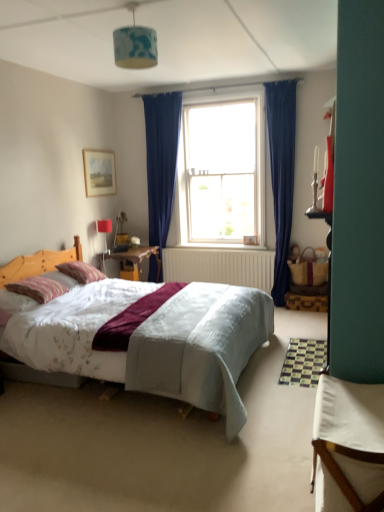
Measure the distance between white glass window at center and camera.

white glass window at center and camera are 5.07 meters apart from each other.

The image size is (384, 512). What do you see at coordinates (221, 170) in the screenshot? I see `white glass window at center` at bounding box center [221, 170].

Find the location of a particular element. The height and width of the screenshot is (512, 384). striped fabric pillow at left, which ranks as the 2th pillow in front-to-back order is located at coordinates (81, 272).

Where is `white fabric table at lower right`? This screenshot has width=384, height=512. white fabric table at lower right is located at coordinates (348, 446).

Does white glass window at center have a larger size compared to striped fabric pillow at left, which ranks as the 2th pillow in front-to-back order?

Indeed, white glass window at center has a larger size compared to striped fabric pillow at left, which ranks as the 2th pillow in front-to-back order.

Considering the relative sizes of white glass window at center and striped fabric pillow at left, which is the first pillow in back-to-front order, in the image provided, is white glass window at center taller than striped fabric pillow at left, which is the first pillow in back-to-front order,?

Yes.

From the image's perspective, which pillow is the 1st one below the white glass window at center? Please provide its 2D coordinates.

[(81, 272)]

Is white glass window at center not near striped fabric pillow at left, which is the first pillow in back-to-front order?

white glass window at center is positioned a significant distance from striped fabric pillow at left, which is the first pillow in back-to-front order.

Is blue fabric lampshade at upper center aimed at striped cotton pillow at left, the first pillow when ordered from front to back?

No, blue fabric lampshade at upper center is not turned towards striped cotton pillow at left, the first pillow when ordered from front to back.

Which is behind, point (122, 30) or point (22, 292)?

The point (22, 292) is farther.

Who is shorter, blue fabric lampshade at upper center or striped cotton pillow at left, marked as the second pillow in a back-to-front arrangement?

striped cotton pillow at left, marked as the second pillow in a back-to-front arrangement.

From the image's perspective, is white fabric table at lower right positioned above or below blue fabric lampshade at upper center?

Clearly, from the image's perspective, white fabric table at lower right is below blue fabric lampshade at upper center.

From the picture: Can you confirm if white fabric table at lower right is shorter than blue fabric lampshade at upper center?

No.

Consider the image. Is white fabric table at lower right positioned before blue fabric lampshade at upper center?

Yes, white fabric table at lower right is closer to the camera.

Is white fabric table at lower right not close to blue fabric lampshade at upper center?

Yes, white fabric table at lower right and blue fabric lampshade at upper center are located far from each other.

Which is farther from the camera, (71, 268) or (152, 42)?

The point (71, 268) is farther.

From a real-world perspective, is striped fabric pillow at left, which is the first pillow in back-to-front order, under blue fabric lampshade at upper center?

Indeed, from a real-world perspective, striped fabric pillow at left, which is the first pillow in back-to-front order, is positioned beneath blue fabric lampshade at upper center.

Which is more to the left, striped fabric pillow at left, which is the first pillow in back-to-front order, or blue fabric lampshade at upper center?

From the viewer's perspective, striped fabric pillow at left, which is the first pillow in back-to-front order, appears more on the left side.

Is striped fabric pillow at left, which is the first pillow in back-to-front order, facing away from blue fabric lampshade at upper center?

No, striped fabric pillow at left, which is the first pillow in back-to-front order, is not facing away from blue fabric lampshade at upper center.

Between white glass window at center and blue fabric lampshade at upper center, which one appears on the left side from the viewer's perspective?

From the viewer's perspective, blue fabric lampshade at upper center appears more on the left side.

Are white glass window at center and blue fabric lampshade at upper center located far from each other?

Yes.

From the picture: Which object is thinner, white glass window at center or blue fabric lampshade at upper center?

With smaller width is blue fabric lampshade at upper center.

Are white glass window at center and white fabric table at lower right making contact?

white glass window at center is not next to white fabric table at lower right, and they're not touching.

From a real-world perspective, between white glass window at center and white fabric table at lower right, who is vertically lower?

From a 3D spatial view, white fabric table at lower right is below.

Does white glass window at center have a larger size compared to white fabric table at lower right?

Indeed, white glass window at center has a larger size compared to white fabric table at lower right.

Looking at their sizes, would you say white glass window at center is wider or thinner than white fabric table at lower right?

white glass window at center is thinner than white fabric table at lower right.

Which point is more forward, (124, 48) or (319, 436)?

The point (319, 436) is more forward.

From the picture: Is blue fabric lampshade at upper center surrounding white fabric table at lower right?

Definitely not — white fabric table at lower right is not inside blue fabric lampshade at upper center.

Is blue fabric lampshade at upper center not near white fabric table at lower right?

Yes.

Starting from the white glass window at center, which pillow is the 1st one in front? Please provide its 2D coordinates.

[(81, 272)]

Which pillow is the 2nd one when counting from the left side of the blue fabric lampshade at upper center? Please provide its 2D coordinates.

[(38, 288)]

Based on their spatial positions, is white glass window at center or blue fabric lampshade at upper center closer to striped fabric pillow at left, which is the first pillow in back-to-front order?

Based on the image, blue fabric lampshade at upper center appears to be nearer to striped fabric pillow at left, which is the first pillow in back-to-front order.

From the image, which object appears to be farther from white fabric table at lower right, striped cotton pillow at left, marked as the second pillow in a back-to-front arrangement, or blue fabric lampshade at upper center?

striped cotton pillow at left, marked as the second pillow in a back-to-front arrangement.

Considering their positions, is wooden picture frame at upper left positioned further to white glass window at center than blue fabric lampshade at upper center?

Based on the image, blue fabric lampshade at upper center appears to be further to white glass window at center.

Estimate the real-world distances between objects in this image. Which object is further from white glass window at center, wooden picture frame at upper left or striped cotton pillow at left, the first pillow when ordered from front to back?

The object further to white glass window at center is striped cotton pillow at left, the first pillow when ordered from front to back.

Looking at the image, which one is located closer to white glass window at center, striped cotton pillow at left, the first pillow when ordered from front to back, or striped fabric pillow at left, which ranks as the 2th pillow in front-to-back order?

Based on the image, striped fabric pillow at left, which ranks as the 2th pillow in front-to-back order, appears to be nearer to white glass window at center.

Which object lies nearer to the anchor point blue fabric lampshade at upper center, white fabric table at lower right or wooden picture frame at upper left?

white fabric table at lower right is closer to blue fabric lampshade at upper center.

Based on their spatial positions, is white glass window at center or striped cotton pillow at left, the first pillow when ordered from front to back, closer to striped fabric pillow at left, which ranks as the 2th pillow in front-to-back order?

striped cotton pillow at left, the first pillow when ordered from front to back.

Estimate the real-world distances between objects in this image. Which object is further from striped fabric pillow at left, which is the first pillow in back-to-front order, wooden picture frame at upper left or striped cotton pillow at left, marked as the second pillow in a back-to-front arrangement?

wooden picture frame at upper left is further to striped fabric pillow at left, which is the first pillow in back-to-front order.

This screenshot has width=384, height=512. I want to click on pillow between striped cotton pillow at left, the first pillow when ordered from front to back, and wooden picture frame at upper left in the front-back direction, so click(81, 272).

Find the location of `pillow located between white fabric table at lower right and striped fabric pillow at left, which ranks as the 2th pillow in front-to-back order, in the depth direction`. pillow located between white fabric table at lower right and striped fabric pillow at left, which ranks as the 2th pillow in front-to-back order, in the depth direction is located at coordinates (38, 288).

You are a GUI agent. You are given a task and a screenshot of the screen. Output one action in this format:
    pyautogui.click(x=<x>, y=<y>)
    Task: Click on the lamp between white fabric table at lower right and striped fabric pillow at left, which ranks as the 2th pillow in front-to-back order, along the z-axis
    The image size is (384, 512).
    Given the screenshot: What is the action you would take?
    pyautogui.click(x=135, y=44)

The height and width of the screenshot is (512, 384). What are the coordinates of `pillow situated between wooden picture frame at upper left and white glass window at center from left to right` in the screenshot? It's located at (81, 272).